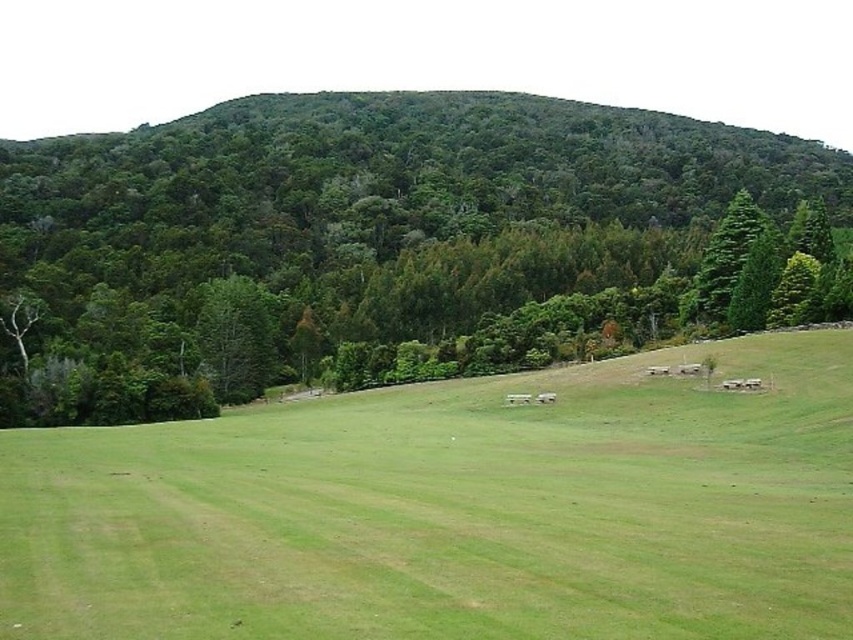
You are a hiker who wants to set up a tent in the green grassy pasture at center. However, you notice the green leafy tree at upper center nearby. Considering their heights, will the tree block sunlight from reaching your tent during the day?

The green grassy pasture at center is shorter than the green leafy tree at upper center, so the tree will likely block sunlight from reaching the tent depending on the time of day and the tree canopy density.

You are standing in the middle of the green grassy pasture at center and want to walk towards the green leafy tree at upper center. Which direction should you head to get closer to the tree?

Since the green grassy pasture at center is closer to the viewer than the green leafy tree at upper center, you should walk forward towards the upper part of the image to get closer to the green leafy tree at upper center.

You are a drone operator planning to fly a drone over the green grassy pasture at center. The drone has a maximum flight radius of 10 meters from its starting point. If you start at the coordinates provided in the scene description, can you ensure the drone stays within the pasture area?

The green grassy pasture at center is located at point (454, 512). Since the drone has a maximum flight radius of 10 meters, it can stay within the pasture area as long as the starting point is within the pasture and the flight path remains within the 10 meters radius.